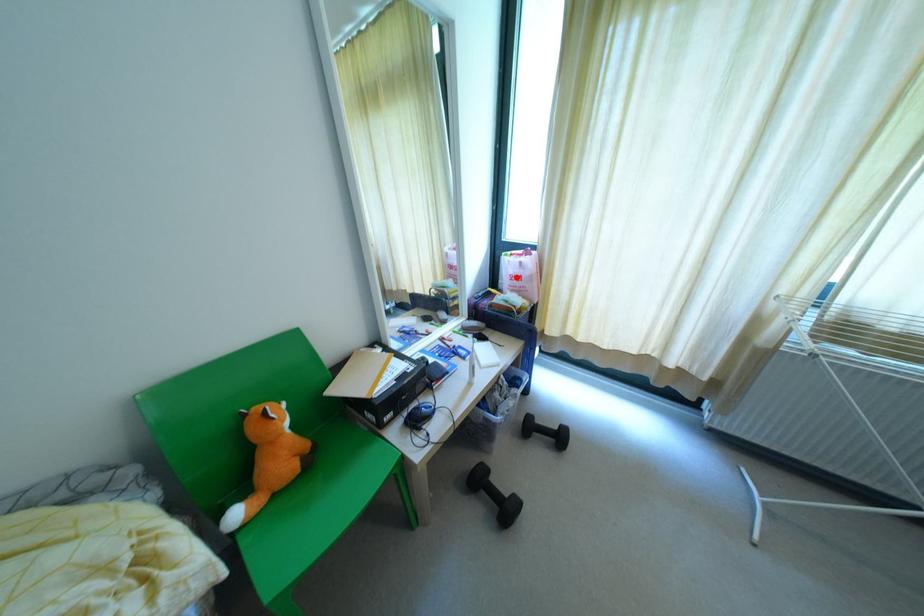
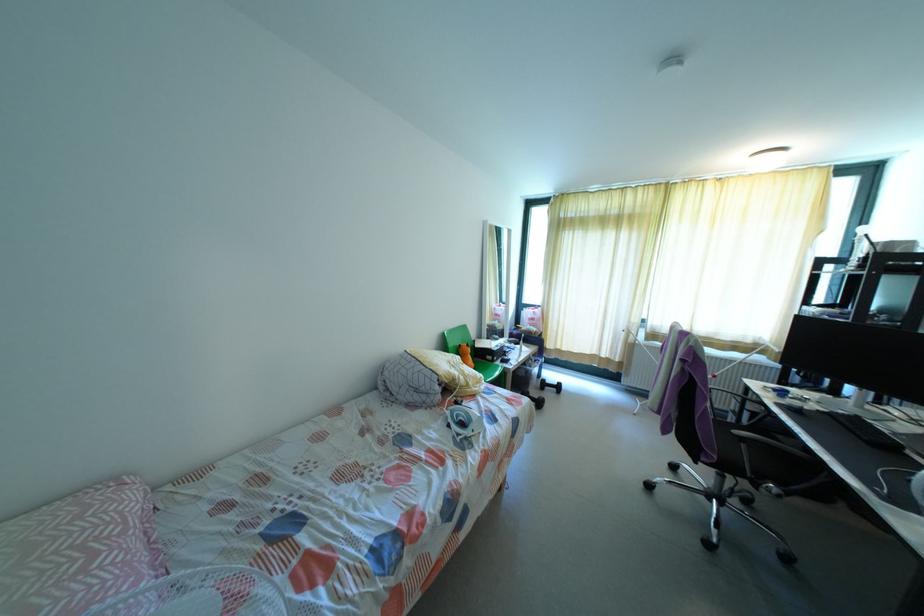
Where in the second image is the point corresponding to the highlighted location from the first image?

(531, 318)